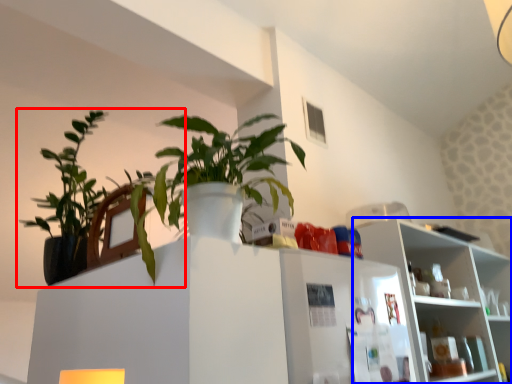
Question: Which of the following is the closest to the observer, houseplant (highlighted by a red box) or shelf (highlighted by a blue box)?

Choices:
 (A) houseplant
 (B) shelf

Answer: (A)